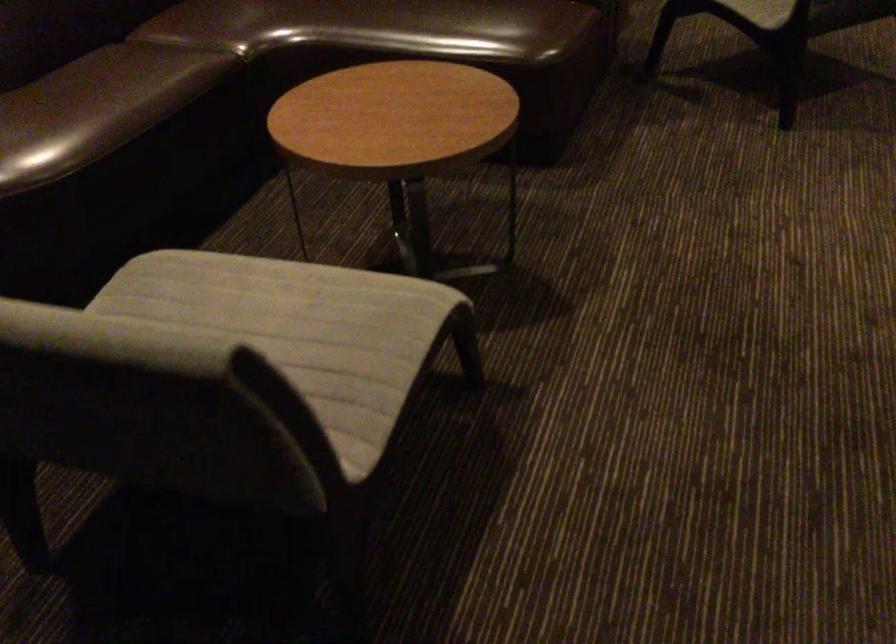
The width and height of the screenshot is (896, 644). What do you see at coordinates (444, 26) in the screenshot?
I see `the brown sofa sitting surface` at bounding box center [444, 26].